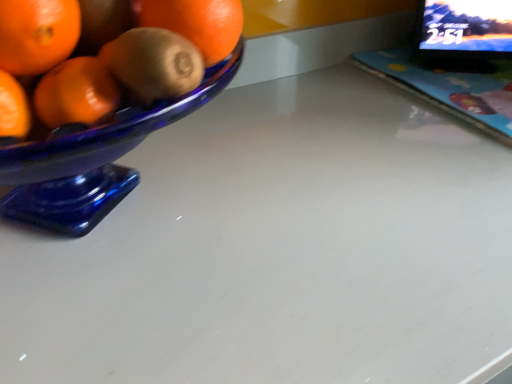
You are a GUI agent. You are given a task and a screenshot of the screen. Output one action in this format:
    pyautogui.click(x=<x>, y=<y>)
    Task: Click on the vacant space in front of black glossy computer monitor at upper right
    
    Given the screenshot: What is the action you would take?
    pyautogui.click(x=471, y=89)